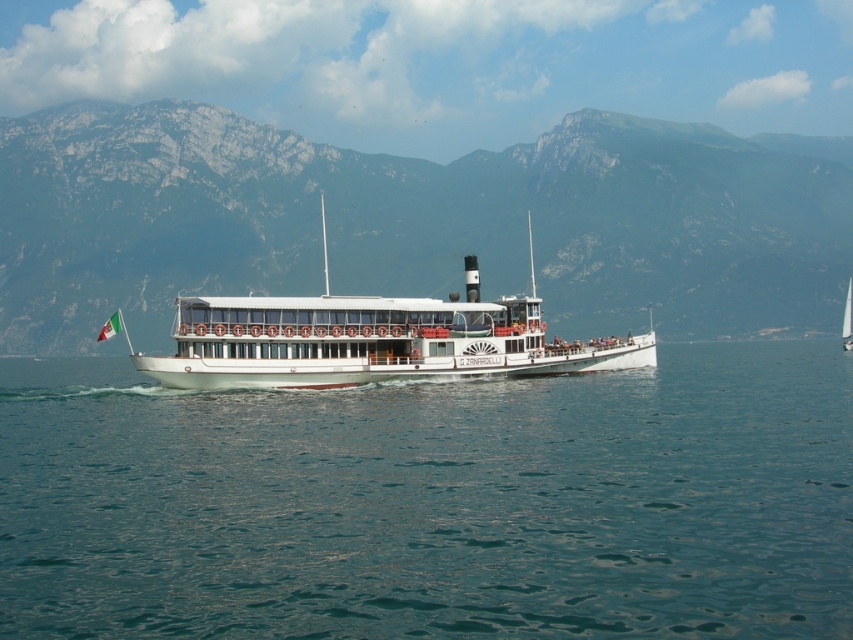
Can you confirm if clear blue water at center is taller than white polished wood boat at center?

In fact, clear blue water at center may be shorter than white polished wood boat at center.

Does clear blue water at center have a lesser height compared to white polished wood boat at center?

Yes.

Where is `clear blue water at center`? clear blue water at center is located at coordinates pyautogui.click(x=433, y=502).

Between point (834, 348) and point (120, 182), which one is positioned in front?

Point (834, 348) is more forward.

Looking at this image, between clear blue water at center and green rocky mountain at center, which one is positioned lower?

Positioned lower is clear blue water at center.

Which is in front, point (42, 611) or point (828, 296)?

Point (42, 611)

Image resolution: width=853 pixels, height=640 pixels. In order to click on clear blue water at center in this screenshot , I will do coord(433,502).

Is the position of green rocky mountain at center less distant than that of white polished wood boat at center?

No.

Who is more distant from viewer, (711,326) or (364,337)?

The point (711,326) is behind.

Is point (231, 230) positioned after point (296, 323)?

Yes.

At what (x,y) coordinates should I click in order to perform the action: click on green rocky mountain at center. Please return your answer as a coordinate pair (x, y). Looking at the image, I should click on (410, 221).